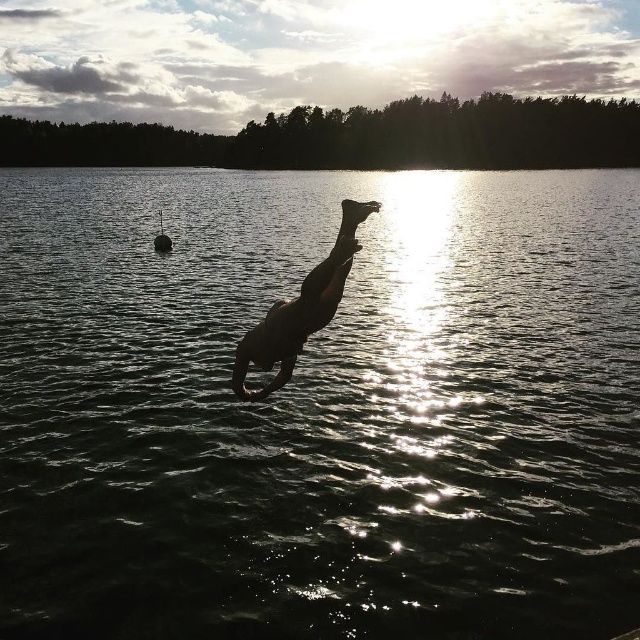
Question: Which point is farther from the camera taking this photo?

Choices:
 (A) (332, 305)
 (B) (474, 429)

Answer: (B)

Question: In this image, where is dark water at center located relative to black matte person at center?

Choices:
 (A) above
 (B) below

Answer: (A)

Question: Is dark water at center smaller than black matte person at center?

Choices:
 (A) no
 (B) yes

Answer: (A)

Question: Can you confirm if dark water at center is wider than black matte person at center?

Choices:
 (A) no
 (B) yes

Answer: (B)